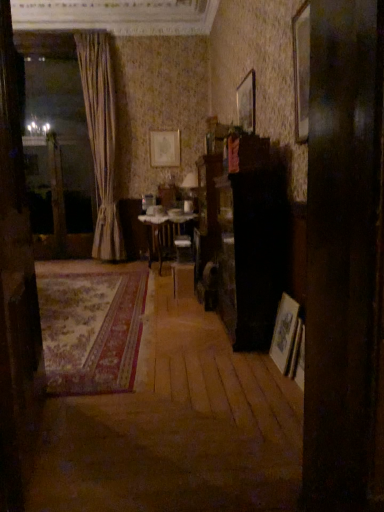
Question: From a real-world perspective, does carpeted rug at center stand above wooden picture frame at right, which is counted as the third picture frame, starting from the back?

Choices:
 (A) yes
 (B) no

Answer: (B)

Question: Is wooden picture frame at right, the first picture frame in the right-to-left sequence, at the back of carpeted rug at center?

Choices:
 (A) yes
 (B) no

Answer: (B)

Question: Could wooden picture frame at right, arranged as the 1th picture frame when ordered from the bottom, be considered to be inside carpeted rug at center?

Choices:
 (A) yes
 (B) no

Answer: (B)

Question: Can you confirm if carpeted rug at center is taller than wooden picture frame at right, which is counted as the third picture frame, starting from the back?

Choices:
 (A) no
 (B) yes

Answer: (A)

Question: Is carpeted rug at center to the left of wooden picture frame at right, which is counted as the third picture frame, starting from the back, from the viewer's perspective?

Choices:
 (A) no
 (B) yes

Answer: (B)

Question: From a real-world perspective, is carpeted rug at center below wooden picture frame at right, the 3th picture frame in the top-to-bottom sequence?

Choices:
 (A) no
 (B) yes

Answer: (B)

Question: From a real-world perspective, is wooden door at left on top of wooden table at center?

Choices:
 (A) no
 (B) yes

Answer: (B)

Question: Could you tell me if wooden door at left is facing wooden table at center?

Choices:
 (A) no
 (B) yes

Answer: (A)

Question: Does wooden door at left have a larger size compared to wooden table at center?

Choices:
 (A) yes
 (B) no

Answer: (B)

Question: Does wooden door at left lie behind wooden table at center?

Choices:
 (A) yes
 (B) no

Answer: (B)

Question: Are wooden door at left and wooden table at center making contact?

Choices:
 (A) no
 (B) yes

Answer: (A)

Question: Can you confirm if wooden door at left is shorter than wooden table at center?

Choices:
 (A) no
 (B) yes

Answer: (A)

Question: From a real-world perspective, is wooden picture frame at upper right, positioned as the second picture frame in front-to-back order, on beige fabric curtain at left?

Choices:
 (A) yes
 (B) no

Answer: (A)